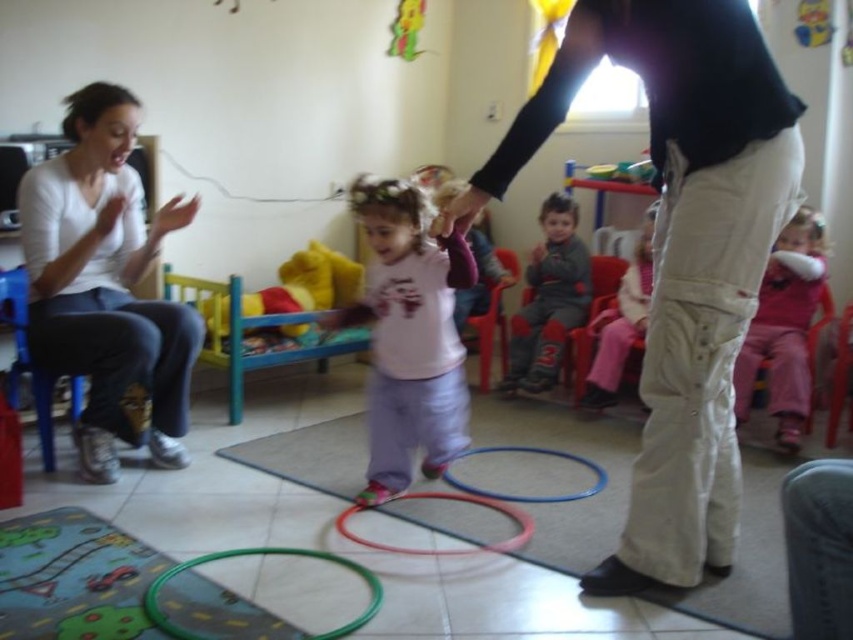
Question: Does khaki cotton pants at center have a larger size compared to yellow plush bear at center?

Choices:
 (A) no
 (B) yes

Answer: (B)

Question: Which point is closer to the camera?

Choices:
 (A) (492, 504)
 (B) (637, 310)
 (C) (181, 340)
 (D) (639, 467)

Answer: (D)

Question: Does light pink fabric pants at center have a lesser width compared to translucent plastic hoop at center?

Choices:
 (A) yes
 (B) no

Answer: (A)

Question: Which object appears farthest from the camera in this image?

Choices:
 (A) rubberized plastic hoop at center
 (B) pink cotton shirt at center
 (C) yellow plush bear at center

Answer: (C)

Question: Among these points, which one is nearest to the camera?

Choices:
 (A) (345, 512)
 (B) (585, 492)
 (C) (508, 360)

Answer: (A)

Question: In this image, where is khaki cotton pants at center located relative to translucent plastic hoop at center?

Choices:
 (A) left
 (B) right

Answer: (B)